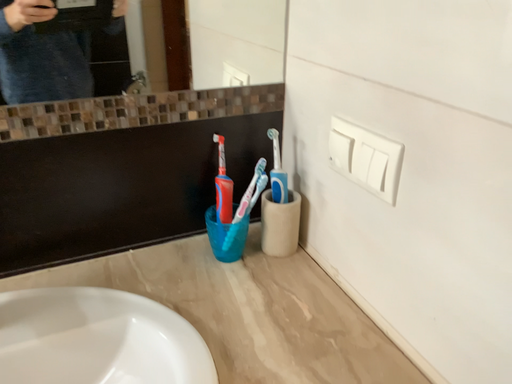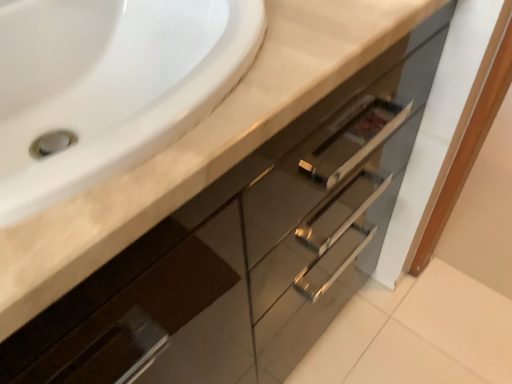
Question: Which way did the camera rotate in the video?

Choices:
 (A) rotated right
 (B) rotated left

Answer: (A)